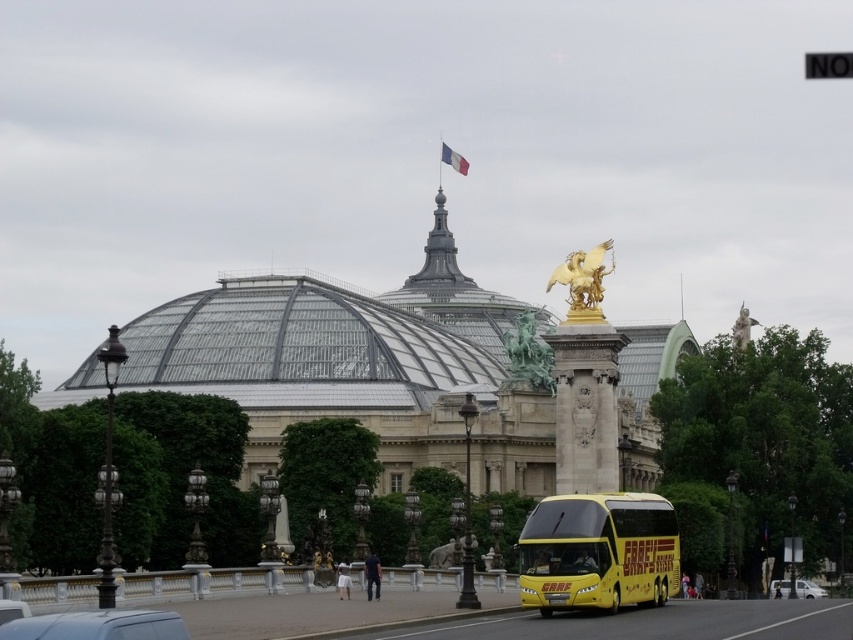
Does metallic gray van at lower left have a lesser width compared to white matte van at lower right?

No, metallic gray van at lower left is not thinner than white matte van at lower right.

Does point (149, 618) come farther from viewer compared to point (824, 595)?

No, it is in front of (824, 595).

I want to click on metallic gray van at lower left, so click(97, 625).

Can you confirm if yellow matte/decorative bus at lower right is shorter than green patina statue at center?

Yes.

Between yellow matte/decorative bus at lower right and green patina statue at center, which one appears on the right side from the viewer's perspective?

yellow matte/decorative bus at lower right is more to the right.

Is point (585, 545) farther from viewer compared to point (538, 364)?

No, it is in front of (538, 364).

Locate an element on the screen. The height and width of the screenshot is (640, 853). yellow matte/decorative bus at lower right is located at coordinates (598, 552).

Consider the image. Which of these two, matte glass dome at center or metallic gray van at lower left, stands taller?

matte glass dome at center

Between matte glass dome at center and metallic gray van at lower left, which one appears on the left side from the viewer's perspective?

From the viewer's perspective, metallic gray van at lower left appears more on the left side.

Which is in front, point (175, 561) or point (16, 620)?

Point (16, 620) is more forward.

The width and height of the screenshot is (853, 640). Find the location of `matte glass dome at center`. matte glass dome at center is located at coordinates (358, 365).